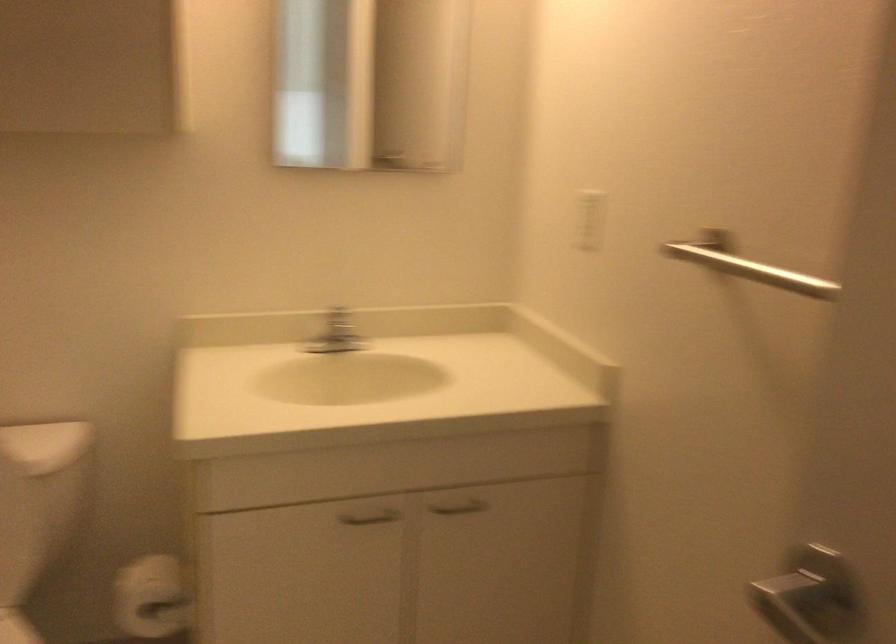
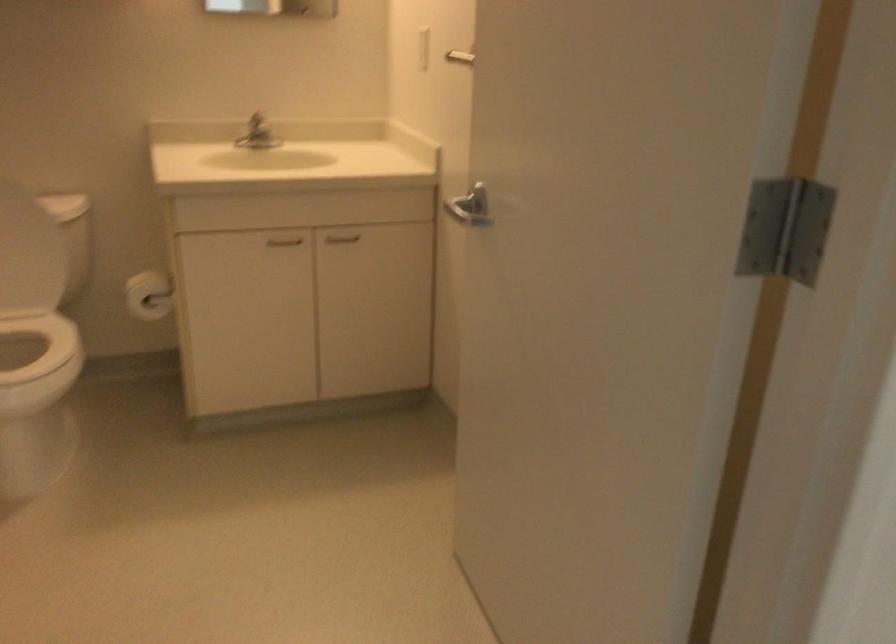
Question: In a continuous first-person perspective shot, in which direction is the camera moving?

Choices:
 (A) Left
 (B) Right
 (C) Forward
 (D) Backward

Answer: (D)